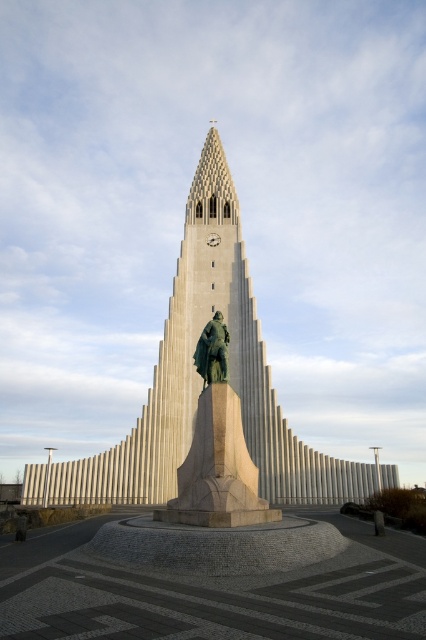
You are an architect designing a new pathway between the green polished stone statue at center and the bronze statue at center. The pathway must be wide enough for two people to walk side by side comfortably. Assuming each person requires 2 feet of space, can the pathway between the two statues accommodate this requirement?

The pathway between the green polished stone statue at center and the bronze statue at center is 18.61 feet apart. Since two people require a combined width of 4 feet, the distance between the statues is sufficient to accommodate the pathway width.

You are an architect visiting the site. You want to take a photo of both the light gray stone tower at center and the green polished stone statue at center. If you stand at the base of the tower, will the statue be fully visible in the frame without moving your camera?

The light gray stone tower at center is much taller than the green polished stone statue at center. Since you are standing at the base of the tower, the statue should be fully visible in the frame as it is shorter and positioned in front.

You are standing in front of the tower and want to determine the relative positions of two points marked on the tower. The first point is at coordinates point [230,362] and the second is at point [210,323]. Which point is closer to you?

Point [230,362] is further to the viewer than point [210,323], so the point closer to you is point [210,323].